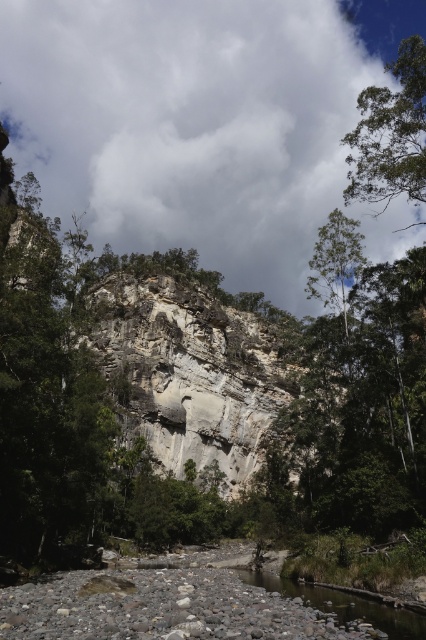
How far apart are gray rock formation at center and green leafy tree at upper right?

50.99 meters

Which is below, gray rock formation at center or green leafy tree at upper right?

gray rock formation at center is below.

Does point (173, 289) come behind point (420, 51)?

Yes, it is behind point (420, 51).

Where is `gray rock formation at center`? gray rock formation at center is located at coordinates (190, 372).

Consider the image. Which is below, white fluffy cloud at upper center or smooth gravel river at lower center?

smooth gravel river at lower center

Does white fluffy cloud at upper center appear over smooth gravel river at lower center?

Yes, white fluffy cloud at upper center is above smooth gravel river at lower center.

Describe the element at coordinates (195, 128) in the screenshot. The width and height of the screenshot is (426, 640). I see `white fluffy cloud at upper center` at that location.

Identify the location of white fluffy cloud at upper center. (195, 128).

Between gray rock formation at center and smooth gravel river at lower center, which one is positioned higher?

Positioned higher is gray rock formation at center.

Measure the distance from gray rock formation at center to smooth gravel river at lower center.

The distance of gray rock formation at center from smooth gravel river at lower center is 159.48 feet.

Which is in front, point (184, 448) or point (374, 625)?

Positioned in front is point (374, 625).

Where is `gray rock formation at center`? This screenshot has height=640, width=426. gray rock formation at center is located at coordinates (190, 372).